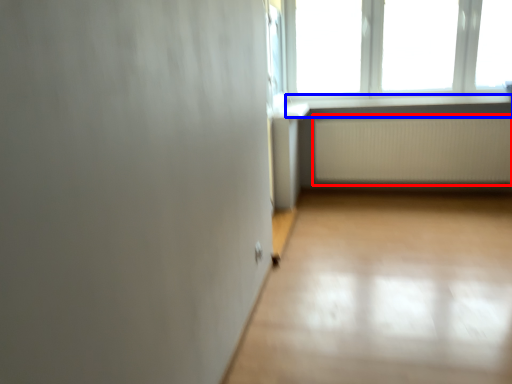
Question: Which object appears closest to the camera in this image, radiator (highlighted by a red box) or window sill (highlighted by a blue box)?

Choices:
 (A) radiator
 (B) window sill

Answer: (B)